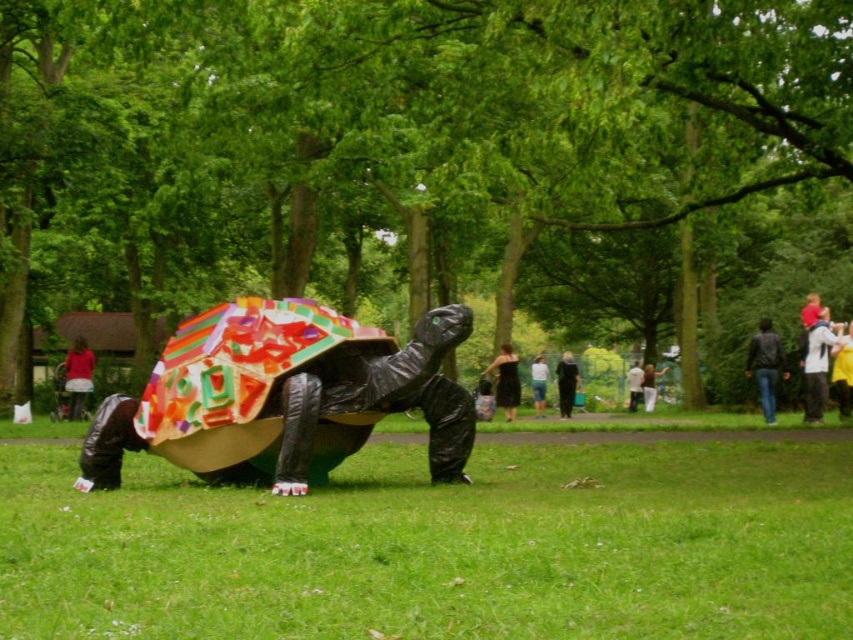
Can you confirm if white cotton shirt at center is positioned to the right of black fabric dress at center?

Indeed, white cotton shirt at center is positioned on the right side of black fabric dress at center.

Is point (801, 360) closer to viewer compared to point (564, 410)?

Yes, it is in front of point (564, 410).

Image resolution: width=853 pixels, height=640 pixels. What are the coordinates of `white cotton shirt at center` in the screenshot? It's located at (816, 355).

Can you confirm if multicolored painted shell at center is wider than leather jacket at right?

Correct, the width of multicolored painted shell at center exceeds that of leather jacket at right.

Does multicolored painted shell at center come behind leather jacket at right?

No, it is not.

Is point (161, 435) farther from viewer compared to point (753, 333)?

No, it is in front of (753, 333).

Where is `multicolored painted shell at center`? multicolored painted shell at center is located at coordinates (293, 387).

Measure the distance between point (572, 392) and camera.

95.13 feet

Between black fabric dress at center and denim jacket at center, which one is positioned lower?

denim jacket at center is below.

You are a GUI agent. You are given a task and a screenshot of the screen. Output one action in this format:
    pyautogui.click(x=<x>, y=<y>)
    Task: Click on the black fabric dress at center
    This screenshot has height=640, width=853.
    Given the screenshot: What is the action you would take?
    pyautogui.click(x=566, y=384)

What are the coordinates of `black fabric dress at center` in the screenshot? It's located at (566, 384).